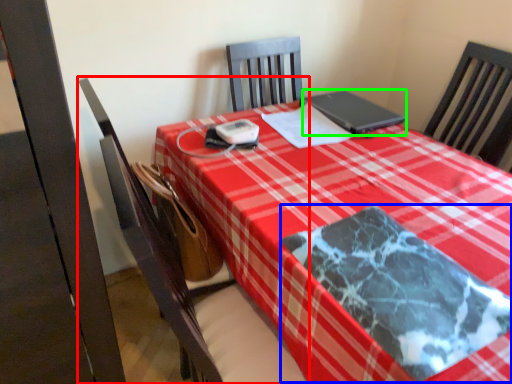
Question: Estimate the real-world distances between objects in this image. Which object is farther from chair (highlighted by a red box), blanket (highlighted by a blue box) or laptop (highlighted by a green box)?

Choices:
 (A) blanket
 (B) laptop

Answer: (B)